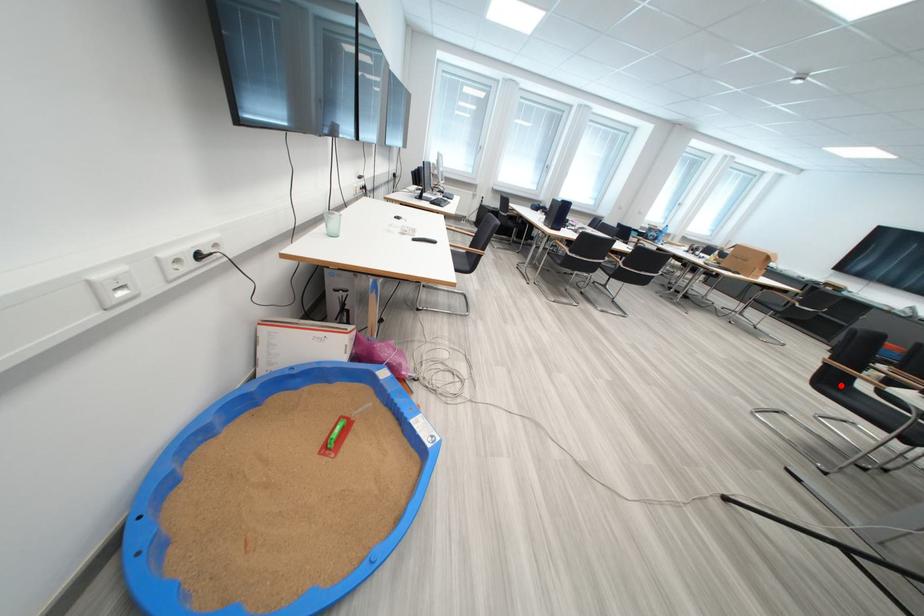
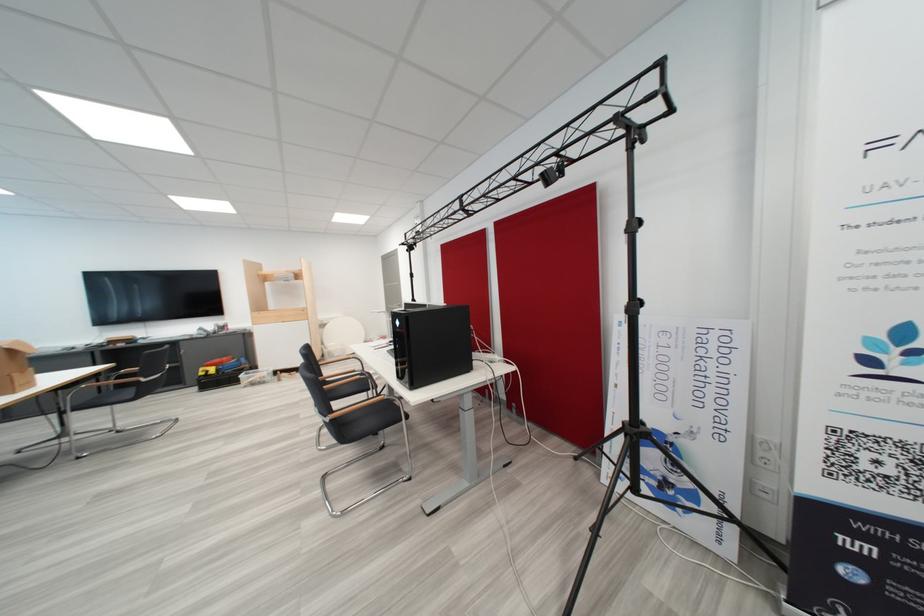
In the second image, find the point that corresponds to the highlighted location in the first image.

(355, 430)